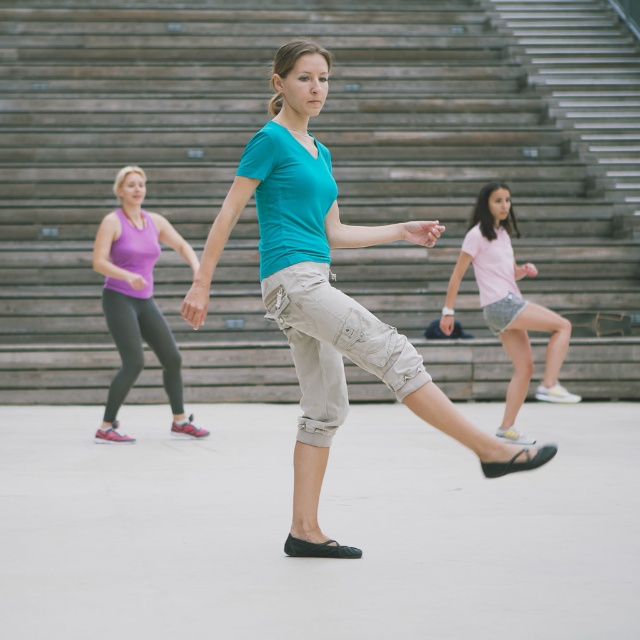
Can you confirm if wooden stairs at center is thinner than teal matte shirt at center?

No, wooden stairs at center is not thinner than teal matte shirt at center.

Is the position of wooden stairs at center less distant than that of teal matte shirt at center?

No, wooden stairs at center is behind teal matte shirt at center.

Is point (8, 4) farther from viewer compared to point (307, 268)?

That is True.

Find the location of a particular element. wooden stairs at center is located at coordinates (332, 163).

Does point (115, 81) come farther from viewer compared to point (556, 364)?

Yes.

The width and height of the screenshot is (640, 640). Describe the element at coordinates (332, 163) in the screenshot. I see `wooden stairs at center` at that location.

Is point (179, 172) closer to viewer compared to point (490, 208)?

No, it is not.

Where is `wooden stairs at center`? wooden stairs at center is located at coordinates (332, 163).

Between teal matte shirt at center and light pink cotton shorts at center, which one appears on the right side from the viewer's perspective?

Positioned to the right is light pink cotton shorts at center.

Does teal matte shirt at center appear on the left side of light pink cotton shorts at center?

Correct, you'll find teal matte shirt at center to the left of light pink cotton shorts at center.

Image resolution: width=640 pixels, height=640 pixels. Describe the element at coordinates (324, 292) in the screenshot. I see `teal matte shirt at center` at that location.

The width and height of the screenshot is (640, 640). What are the coordinates of `teal matte shirt at center` in the screenshot? It's located at (324, 292).